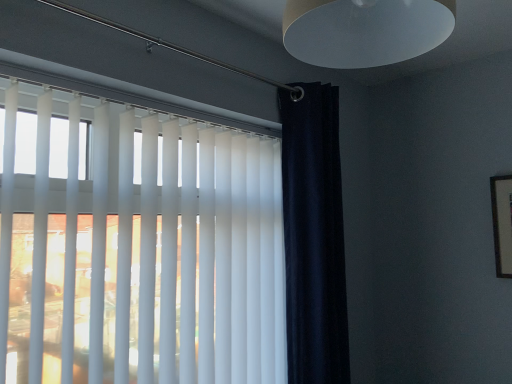
Question: Is navy blue velvet curtain at right completely or partially outside of matte white lampshade at upper center?

Choices:
 (A) yes
 (B) no

Answer: (A)

Question: Is navy blue velvet curtain at right placed right next to matte white lampshade at upper center?

Choices:
 (A) no
 (B) yes

Answer: (A)

Question: Is navy blue velvet curtain at right shorter than matte white lampshade at upper center?

Choices:
 (A) yes
 (B) no

Answer: (B)

Question: Can you confirm if navy blue velvet curtain at right is bigger than matte white lampshade at upper center?

Choices:
 (A) no
 (B) yes

Answer: (B)

Question: Is navy blue velvet curtain at right smaller than matte white lampshade at upper center?

Choices:
 (A) no
 (B) yes

Answer: (A)

Question: Considering the positions of navy blue velvet curtain at right and matte white lampshade at upper center in the image, is navy blue velvet curtain at right bigger or smaller than matte white lampshade at upper center?

Choices:
 (A) small
 (B) big

Answer: (B)

Question: From the image's perspective, is navy blue velvet curtain at right above or below matte white lampshade at upper center?

Choices:
 (A) above
 (B) below

Answer: (B)

Question: Considering the positions of navy blue velvet curtain at right and matte white lampshade at upper center in the image, is navy blue velvet curtain at right taller or shorter than matte white lampshade at upper center?

Choices:
 (A) tall
 (B) short

Answer: (A)

Question: From a real-world perspective, is navy blue velvet curtain at right above or below matte white lampshade at upper center?

Choices:
 (A) above
 (B) below

Answer: (B)

Question: From the image's perspective, is white matte blinds at upper left located above or below matte white lampshade at upper center?

Choices:
 (A) above
 (B) below

Answer: (B)

Question: Is point (31, 367) positioned closer to the camera than point (441, 41)?

Choices:
 (A) farther
 (B) closer

Answer: (A)

Question: Is white matte blinds at upper left taller or shorter than matte white lampshade at upper center?

Choices:
 (A) tall
 (B) short

Answer: (A)

Question: Considering their positions, is white matte blinds at upper left located in front of or behind matte white lampshade at upper center?

Choices:
 (A) behind
 (B) front

Answer: (A)

Question: Relative to white matte blinds at upper left, is matte white lampshade at upper center in front or behind?

Choices:
 (A) front
 (B) behind

Answer: (A)

Question: Considering the positions of point (289, 52) and point (266, 261), is point (289, 52) closer or farther from the camera than point (266, 261)?

Choices:
 (A) closer
 (B) farther

Answer: (A)